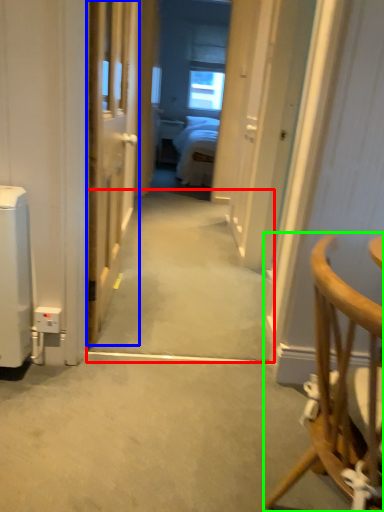
Question: Considering the real-world distances, which object is closest to path (highlighted by a red box)? door (highlighted by a blue box) or chair (highlighted by a green box).

Choices:
 (A) door
 (B) chair

Answer: (A)